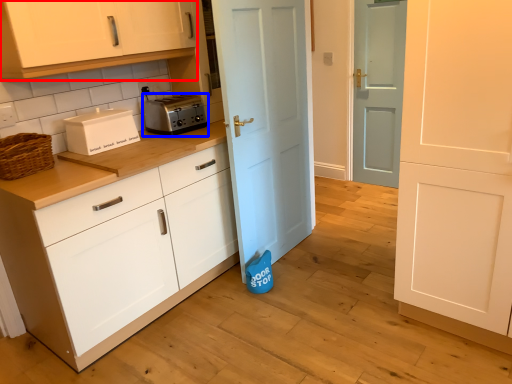
Question: Which object appears farthest to the camera in this image, cabinetry (highlighted by a red box) or toaster (highlighted by a blue box)?

Choices:
 (A) cabinetry
 (B) toaster

Answer: (B)